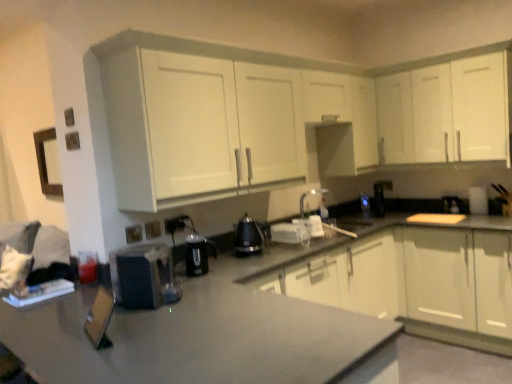
Describe the element at coordinates (445, 112) in the screenshot. I see `white glossy cabinet at upper right, positioned as the third cabinetry in bottom-to-top order` at that location.

Describe the element at coordinates (284, 309) in the screenshot. Image resolution: width=512 pixels, height=384 pixels. I see `gray matte countertop at center` at that location.

Find the location of a particular element. gray matte countertop at center is located at coordinates (284, 309).

This screenshot has height=384, width=512. Describe the element at coordinates (198, 254) in the screenshot. I see `black plastic coffee maker at center, which is the 3th appliance from left to right` at that location.

Describe the element at coordinates (249, 237) in the screenshot. I see `black plastic kettle at center, which ranks as the 3th appliance in right-to-left order` at that location.

Measure the distance between black plastic kettle at center, which is counted as the 4th appliance, starting from the left, and camera.

A distance of 2.51 meters exists between black plastic kettle at center, which is counted as the 4th appliance, starting from the left, and camera.

In order to face wooden cutting board at lower left, which appears as the sixth appliance when viewed from the back, should I rotate leftwards or rightwards?

Rotate left and turn 20.123 degrees.

Describe the element at coordinates (311, 201) in the screenshot. The width and height of the screenshot is (512, 384). I see `white glossy kettle at center, which appears as the 2th appliance when viewed from the right` at that location.

Consider the image. What is the approximate width of white glossy kettle at center, which appears as the 2th appliance when viewed from the right?

It is 26.67 centimeters.

The image size is (512, 384). Find the location of `matte plastic electric outlet at lower center, positioned as the second electric outlet in front-to-back order`. matte plastic electric outlet at lower center, positioned as the second electric outlet in front-to-back order is located at coordinates (152, 230).

Can white matte cabinet at upper center, which is the 2th cabinetry in bottom-to-top order, be found inside black plastic coffee maker at center, positioned as the fourth appliance in back-to-front order?

No, black plastic coffee maker at center, positioned as the fourth appliance in back-to-front order, does not contain white matte cabinet at upper center, which is the 2th cabinetry in bottom-to-top order.

Can you tell me how much black plastic coffee maker at center, arranged as the third appliance when viewed from the front, and white matte cabinet at upper center, which is the 2th cabinetry in bottom-to-top order, differ in facing direction?

There is a 1.56-degree angle between the facing directions of black plastic coffee maker at center, arranged as the third appliance when viewed from the front, and white matte cabinet at upper center, which is the 2th cabinetry in bottom-to-top order.

From the image's perspective, does black plastic coffee maker at center, arranged as the third appliance when viewed from the front, appear lower than white matte cabinet at upper center, which is the 2th cabinetry in bottom-to-top order?

Yes, from the image's perspective, black plastic coffee maker at center, arranged as the third appliance when viewed from the front, is below white matte cabinet at upper center, which is the 2th cabinetry in bottom-to-top order.

Which is less distant, [202,263] or [395,79]?

Point [202,263] is closer to the camera than point [395,79].

Which object is positioned more to the left, white matte cabinet at upper center, which is the 2th cabinetry in bottom-to-top order, or matte black electric outlet at lower left, arranged as the third electric outlet when viewed from the right?

matte black electric outlet at lower left, arranged as the third electric outlet when viewed from the right.

How many degrees apart are the facing directions of white matte cabinet at upper center, which is the 2th cabinetry in bottom-to-top order, and matte black electric outlet at lower left, placed as the 3th electric outlet when sorted from back to front?

0.54 degrees separate the facing orientations of white matte cabinet at upper center, which is the 2th cabinetry in bottom-to-top order, and matte black electric outlet at lower left, placed as the 3th electric outlet when sorted from back to front.

From the image's perspective, which electric outlet is the 3rd one below the white matte cabinet at upper center, positioned as the second cabinetry in top-to-bottom order? Please provide its 2D coordinates.

[(133, 234)]

From the picture: Which is closer to the camera, [418,114] or [133,232]?

Point [133,232]

Between point (187, 217) and point (164, 268), which one is positioned behind?

The point (187, 217) is behind.

How many degrees apart are the facing directions of black plastic electric outlet at lower center, which is counted as the 3th electric outlet, starting from the front, and black plastic coffee maker at lower left, positioned as the 2th appliance in left-to-right order?

They differ by 31.6 degrees in their facing directions.

Could you tell me if black plastic electric outlet at lower center, which ranks as the first electric outlet in right-to-left order, is facing black plastic coffee maker at lower left, the second appliance positioned from the front?

No, black plastic electric outlet at lower center, which ranks as the first electric outlet in right-to-left order, is not aimed at black plastic coffee maker at lower left, the second appliance positioned from the front.

Would you say black plastic coffee maker at lower left, the fifth appliance viewed from the back, is part of black plastic electric outlet at lower center, which ranks as the first electric outlet in right-to-left order,'s contents?

No, black plastic electric outlet at lower center, which ranks as the first electric outlet in right-to-left order, does not contain black plastic coffee maker at lower left, the fifth appliance viewed from the back.

You are a GUI agent. You are given a task and a screenshot of the screen. Output one action in this format:
    pyautogui.click(x=<x>, y=<y>)
    Task: Click on the 2nd electric outlet counting from the left side of the black plastic kettle at center, which is counted as the 4th appliance, starting from the left
    The image size is (512, 384).
    Given the screenshot: What is the action you would take?
    pyautogui.click(x=152, y=230)

Considering the relative sizes of matte plastic electric outlet at lower center, arranged as the 2th electric outlet when viewed from the right, and black plastic kettle at center, which ranks as the 3th appliance in right-to-left order, in the image provided, is matte plastic electric outlet at lower center, arranged as the 2th electric outlet when viewed from the right, shorter than black plastic kettle at center, which ranks as the 3th appliance in right-to-left order,?

Indeed, matte plastic electric outlet at lower center, arranged as the 2th electric outlet when viewed from the right, has a lesser height compared to black plastic kettle at center, which ranks as the 3th appliance in right-to-left order.

Is matte plastic electric outlet at lower center, the second electric outlet in the left-to-right sequence, oriented towards black plastic kettle at center, arranged as the fourth appliance when viewed from the front?

No, matte plastic electric outlet at lower center, the second electric outlet in the left-to-right sequence, does not turn towards black plastic kettle at center, arranged as the fourth appliance when viewed from the front.

From the image's perspective, which one is positioned lower, matte black electric outlet at lower left, arranged as the third electric outlet when viewed from the right, or white glossy kettle at center, which appears as the 2th appliance when viewed from the right?

From the image's view, matte black electric outlet at lower left, arranged as the third electric outlet when viewed from the right, is below.

Is the depth of matte black electric outlet at lower left, arranged as the third electric outlet when viewed from the right, greater than that of white glossy kettle at center, which is the second appliance from back to front?

That is False.

Can we say matte black electric outlet at lower left, which is the first electric outlet in front-to-back order, lies outside white glossy kettle at center, the 5th appliance when ordered from left to right?

Yes, matte black electric outlet at lower left, which is the first electric outlet in front-to-back order, is located beyond the bounds of white glossy kettle at center, the 5th appliance when ordered from left to right.

Is matte black electric outlet at lower left, placed as the 3th electric outlet when sorted from back to front, a part of black plastic electric outlet at lower center, which is counted as the first electric outlet, starting from the back?

That's incorrect, matte black electric outlet at lower left, placed as the 3th electric outlet when sorted from back to front, is not inside black plastic electric outlet at lower center, which is counted as the first electric outlet, starting from the back.

Considering the relative sizes of black plastic electric outlet at lower center, which ranks as the first electric outlet in right-to-left order, and matte black electric outlet at lower left, positioned as the first electric outlet in left-to-right order, in the image provided, is black plastic electric outlet at lower center, which ranks as the first electric outlet in right-to-left order, smaller than matte black electric outlet at lower left, positioned as the first electric outlet in left-to-right order,?

Actually, black plastic electric outlet at lower center, which ranks as the first electric outlet in right-to-left order, might be larger than matte black electric outlet at lower left, positioned as the first electric outlet in left-to-right order.

How different are the orientations of black plastic electric outlet at lower center, which is the 3th electric outlet in left-to-right order, and matte black electric outlet at lower left, placed as the 3th electric outlet when sorted from back to front, in degrees?

The angle between the facing direction of black plastic electric outlet at lower center, which is the 3th electric outlet in left-to-right order, and the facing direction of matte black electric outlet at lower left, placed as the 3th electric outlet when sorted from back to front, is 2.2 degrees.

In the scene shown: Which point is more forward, (213, 243) or (241, 221)?

The point (241, 221) is closer.

From the image's perspective, between black plastic coffee maker at center, which is the 3th appliance from left to right, and black plastic kettle at center, arranged as the fourth appliance when viewed from the front, which one is located above?

From the image's view, black plastic kettle at center, arranged as the fourth appliance when viewed from the front, is above.

Based on the photo, is black plastic coffee maker at center, which is the 3th appliance from left to right, inside or outside of black plastic kettle at center, arranged as the third appliance when viewed from the back?

black plastic coffee maker at center, which is the 3th appliance from left to right, is located beyond the bounds of black plastic kettle at center, arranged as the third appliance when viewed from the back.

From a real-world perspective, is black plastic coffee maker at center, which is the 3th appliance from left to right, below black plastic kettle at center, arranged as the third appliance when viewed from the back?

Correct, in the physical world, black plastic coffee maker at center, which is the 3th appliance from left to right, is lower than black plastic kettle at center, arranged as the third appliance when viewed from the back.

From the image's perspective, starting from the white matte cabinet at upper center, positioned as the second cabinetry in top-to-bottom order, which appliance is the 4th one below? Please provide its 2D coordinates.

[(198, 254)]

You are a GUI agent. You are given a task and a screenshot of the screen. Output one action in this format:
    pyautogui.click(x=<x>, y=<y>)
    Task: Click on the 1st cabinetry located above the matte black electric outlet at lower left, which is the first electric outlet in front-to-back order (from a real-world perspective)
    This screenshot has height=384, width=512.
    Given the screenshot: What is the action you would take?
    pyautogui.click(x=284, y=116)

Estimate the real-world distances between objects in this image. Which object is further from black plastic coffee maker at center, arranged as the 4th appliance when viewed from the right, matte black electric outlet at lower left, which is the first electric outlet in front-to-back order, or white matte cabinet at upper center, which is the 2th cabinetry in bottom-to-top order?

white matte cabinet at upper center, which is the 2th cabinetry in bottom-to-top order.

Based on their spatial positions, is white glossy kettle at center, which is the fifth appliance in front-to-back order, or black plastic coffee maker at lower left, the fifth appliance viewed from the back, closer to white glossy cabinet at upper right, arranged as the first cabinetry when viewed from the top?

white glossy kettle at center, which is the fifth appliance in front-to-back order.

Based on the photo, when comparing their distances from white matte cabinet at upper center, positioned as the second cabinetry in top-to-bottom order, does matte black electric outlet at lower left, which is the first electric outlet in front-to-back order, or satin black coffee maker at right, which is the 1th appliance from back to front, seem closer?

Among the two, matte black electric outlet at lower left, which is the first electric outlet in front-to-back order, is located nearer to white matte cabinet at upper center, positioned as the second cabinetry in top-to-bottom order.

Which object lies further to the anchor point matte plastic electric outlet at lower center, positioned as the second electric outlet in front-to-back order, wooden cutting board at lower left, marked as the 1th appliance in a left-to-right arrangement, or white glossy cabinets at center, marked as the first cabinetry in a bottom-to-top arrangement?

white glossy cabinets at center, marked as the first cabinetry in a bottom-to-top arrangement, lies further to matte plastic electric outlet at lower center, positioned as the second electric outlet in front-to-back order, than the other object.

Estimate the real-world distances between objects in this image. Which object is further from white matte cabinet at upper center, which is the 2th cabinetry in bottom-to-top order, white glossy cabinets at center, marked as the first cabinetry in a bottom-to-top arrangement, or white glossy kettle at center, the 5th appliance when ordered from left to right?

white glossy kettle at center, the 5th appliance when ordered from left to right, is positioned further to the anchor white matte cabinet at upper center, which is the 2th cabinetry in bottom-to-top order.

Which object lies nearer to the anchor point black plastic electric outlet at lower center, which is the 3th electric outlet in left-to-right order, white glossy cabinets at center, which is the 3th cabinetry from top to bottom, or matte plastic electric outlet at lower center, the 2th electric outlet viewed from the back?

matte plastic electric outlet at lower center, the 2th electric outlet viewed from the back, is closer to black plastic electric outlet at lower center, which is the 3th electric outlet in left-to-right order.

Which object lies further to the anchor point wooden cutting board at lower left, which is the 1th appliance in front-to-back order, matte plastic electric outlet at lower center, arranged as the 2th electric outlet when viewed from the right, or black plastic electric outlet at lower center, which is counted as the first electric outlet, starting from the back?

Among the two, black plastic electric outlet at lower center, which is counted as the first electric outlet, starting from the back, is located further to wooden cutting board at lower left, which is the 1th appliance in front-to-back order.

Which object lies nearer to the anchor point black plastic coffee maker at center, which is the 3th appliance from left to right, gray matte countertop at center or white matte cabinet at upper center, which is the 2th cabinetry in bottom-to-top order?

gray matte countertop at center lies closer to black plastic coffee maker at center, which is the 3th appliance from left to right, than the other object.

At what (x,y) coordinates should I click in order to perform the action: click on electric outlet located between black plastic coffee maker at lower left, the fifth appliance viewed from the back, and white glossy cabinets at center, marked as the first cabinetry in a bottom-to-top arrangement, in the left-right direction. Please return your answer as a coordinate pair (x, y). Looking at the image, I should click on (175, 224).

At what (x,y) coordinates should I click in order to perform the action: click on cabinetry between matte plastic electric outlet at lower center, positioned as the second electric outlet in front-to-back order, and white glossy cabinets at center, marked as the first cabinetry in a bottom-to-top arrangement. Please return your answer as a coordinate pair (x, y). Looking at the image, I should click on (284, 116).

Locate an element on the screen. The image size is (512, 384). appliance between white matte cabinet at upper center, which is the 2th cabinetry in bottom-to-top order, and white glossy cabinets at center, which is the 3th cabinetry from top to bottom is located at coordinates (311, 201).

Identify the location of electric outlet situated between matte plastic electric outlet at lower center, positioned as the second electric outlet in front-to-back order, and satin black coffee maker at right, arranged as the 6th appliance when viewed from the left, from left to right. The image size is (512, 384). (175, 224).